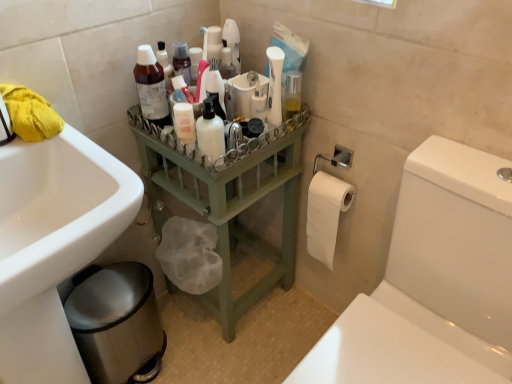
Question: Is white glossy toilet at right turned away from white matte pump bottle at center, which appears as the 2th cleaning product when viewed from the right?

Choices:
 (A) yes
 (B) no

Answer: (B)

Question: From a real-world perspective, is white glossy toilet at right located beneath white matte pump bottle at center, which appears as the 2th cleaning product when viewed from the right?

Choices:
 (A) no
 (B) yes

Answer: (B)

Question: From the image's perspective, is white glossy toilet at right over white matte pump bottle at center, which appears as the 2th cleaning product when viewed from the right?

Choices:
 (A) no
 (B) yes

Answer: (A)

Question: Does white glossy toilet at right have a lesser width compared to white matte pump bottle at center, which ranks as the 2th cleaning product in left-to-right order?

Choices:
 (A) yes
 (B) no

Answer: (B)

Question: Does white glossy toilet at right have a smaller size compared to white matte pump bottle at center, which ranks as the 2th cleaning product in left-to-right order?

Choices:
 (A) yes
 (B) no

Answer: (B)

Question: From a real-world perspective, relative to white matte pump bottle at center, which ranks as the 2th cleaning product in left-to-right order, is translucent plastic bottle at upper center, which is the 3th cleaning product in right-to-left order, vertically above or below?

Choices:
 (A) above
 (B) below

Answer: (B)

Question: Is translucent plastic bottle at upper center, which is the 3th cleaning product in right-to-left order, situated inside white matte pump bottle at center, which ranks as the 2th cleaning product in left-to-right order, or outside?

Choices:
 (A) inside
 (B) outside

Answer: (B)

Question: Considering the positions of point (151, 59) and point (209, 72), is point (151, 59) closer or farther from the camera than point (209, 72)?

Choices:
 (A) closer
 (B) farther

Answer: (B)

Question: In the image, is translucent plastic bottle at upper center, arranged as the 1th cleaning product when viewed from the left, positioned in front of or behind white matte pump bottle at center, which appears as the 2th cleaning product when viewed from the right?

Choices:
 (A) front
 (B) behind

Answer: (B)

Question: Considering the positions of white glossy bottle at upper center, arranged as the third cleaning product when viewed from the left, and yellow fabric at upper left in the image, is white glossy bottle at upper center, arranged as the third cleaning product when viewed from the left, bigger or smaller than yellow fabric at upper left?

Choices:
 (A) small
 (B) big

Answer: (A)

Question: Is white glossy bottle at upper center, arranged as the third cleaning product when viewed from the left, situated inside yellow fabric at upper left or outside?

Choices:
 (A) outside
 (B) inside

Answer: (A)

Question: In the image, is white glossy bottle at upper center, arranged as the third cleaning product when viewed from the left, positioned in front of or behind yellow fabric at upper left?

Choices:
 (A) behind
 (B) front

Answer: (A)

Question: Does point (272, 77) appear closer or farther from the camera than point (35, 137)?

Choices:
 (A) closer
 (B) farther

Answer: (B)

Question: Is white matte lotion bottle at center spatially inside metallic silver bidet at lower left, or outside of it?

Choices:
 (A) inside
 (B) outside

Answer: (B)

Question: From the image's perspective, is white matte lotion bottle at center above or below metallic silver bidet at lower left?

Choices:
 (A) below
 (B) above

Answer: (B)